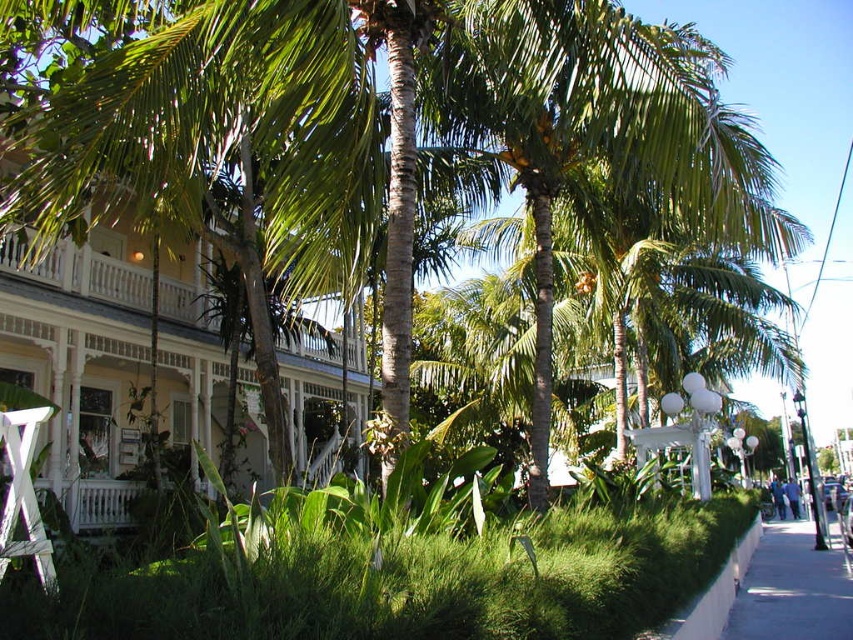
You are standing at the center of the grassy area in the tropical scene. You see a point labeled as point (714, 595). Where is this point located relative to the white concrete curb at lower right?

The point (714, 595) corresponds to the white concrete curb at lower right, so it is located at the lower right position relative to the curb.

In the scene shown: You are a gardener who needs to place a 6.5 feet long decorative fence between the green leafy grass at lower center and the white concrete curb at lower right. Based on the scene, will the fence fit between them?

The distance between the green leafy grass at lower center and the white concrete curb at lower right is 6.44 feet, which is slightly shorter than the 6.5 feet fence. Therefore, the fence will not fit between them as there is insufficient space.

You are standing at the edge of the tropical garden and need to walk from the white concrete curb at lower right to the blue fabric person at lower right. Is the path between them wide enough for you to walk comfortably?

The white concrete curb at lower right might be wider than the blue fabric person at lower right, so the path between them could be wide enough for comfortable walking.